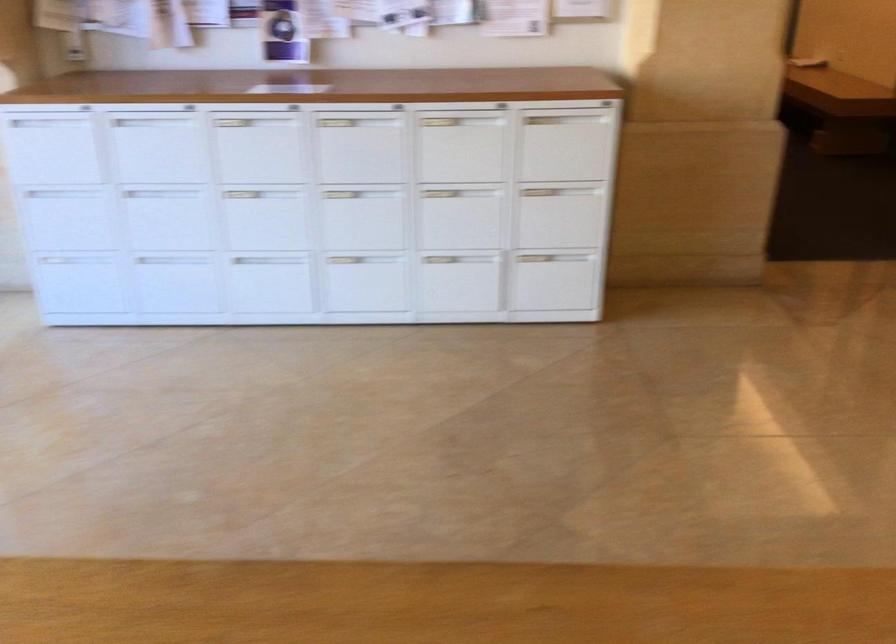
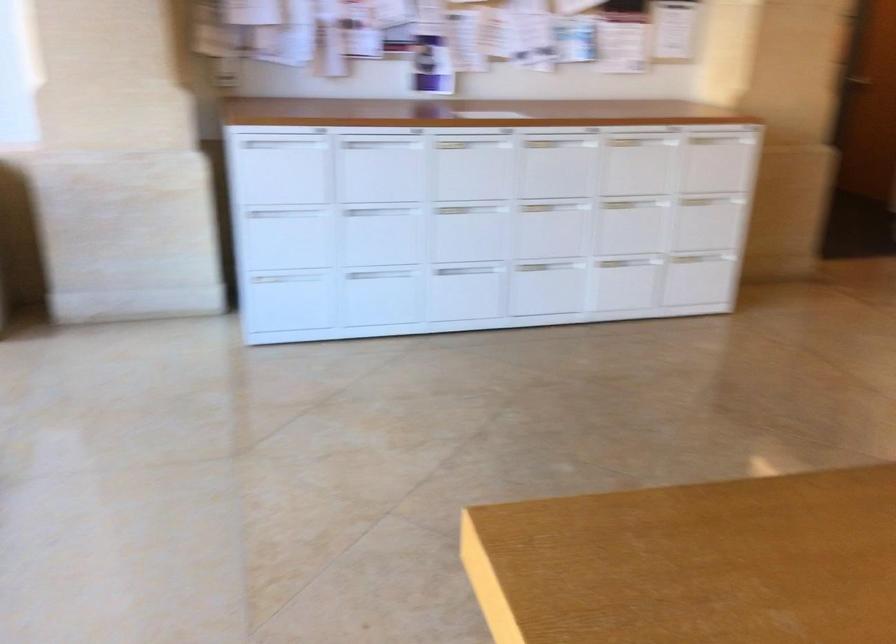
In the second image, find the point that corresponds to (x=373, y=149) in the first image.

(556, 163)